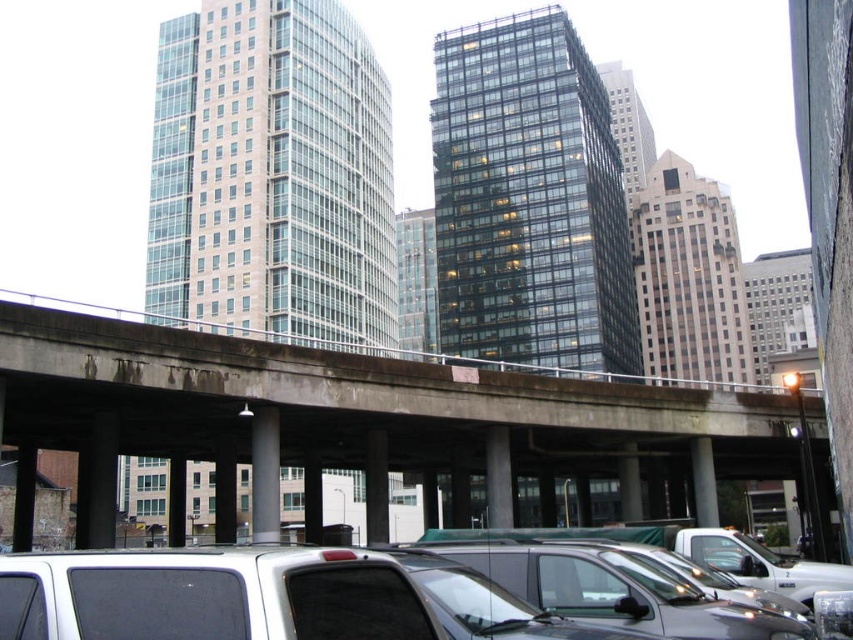
Question: Considering the real-world distances, which object is farthest from the white glossy truck at lower right?

Choices:
 (A) shiny black car at center
 (B) white matte van at lower left
 (C) concrete at center

Answer: (C)

Question: Observing the image, what is the correct spatial positioning of concrete at center in reference to shiny black car at center?

Choices:
 (A) left
 (B) right

Answer: (B)

Question: Is concrete at center below shiny black car at center?

Choices:
 (A) no
 (B) yes

Answer: (B)

Question: Is the position of concrete at center more distant than that of shiny black car at center?

Choices:
 (A) no
 (B) yes

Answer: (B)

Question: Which of these objects is positioned closest to the white matte van at lower left?

Choices:
 (A) concrete at center
 (B) shiny black car at center

Answer: (B)

Question: Which point appears farthest from the camera in this image?

Choices:
 (A) (473, 628)
 (B) (595, 388)

Answer: (B)